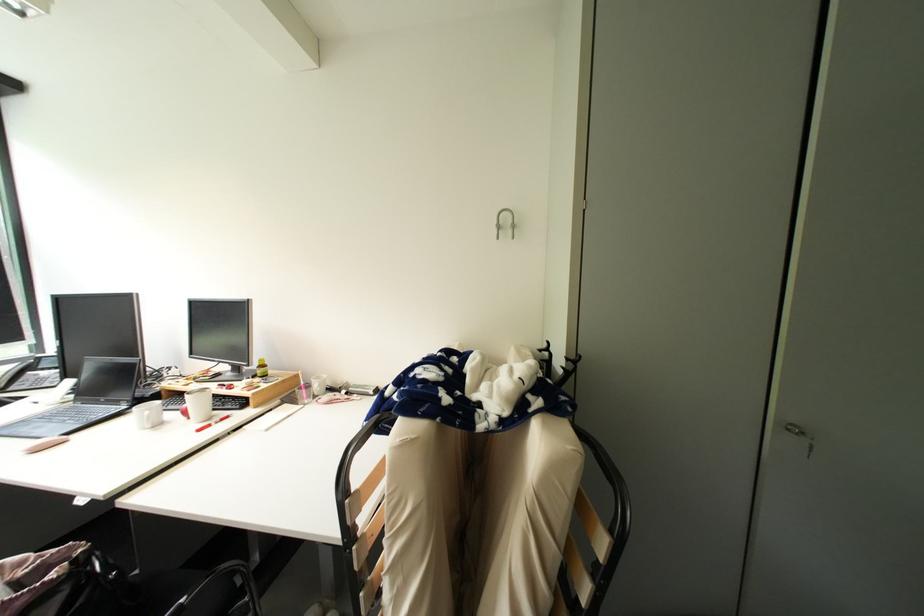
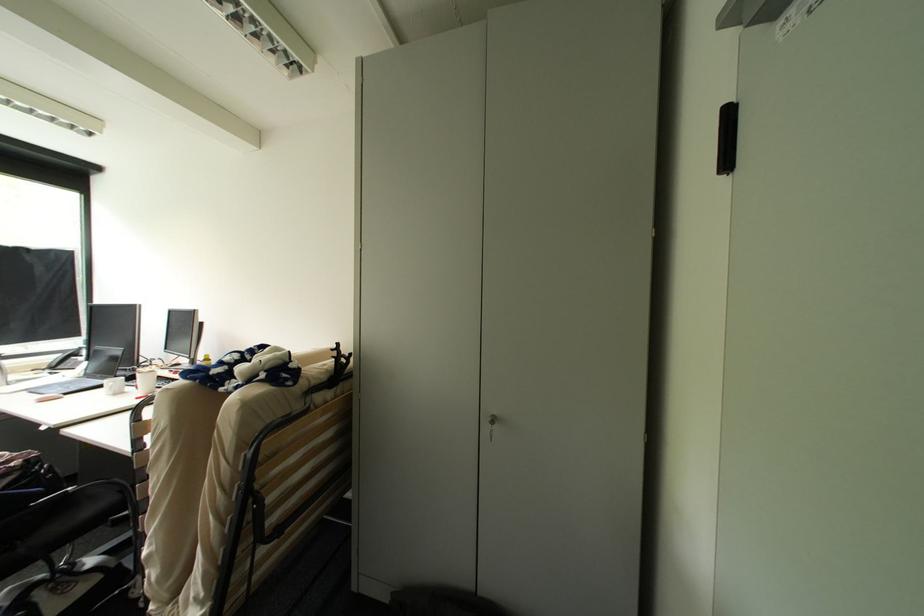
Question: The images are taken continuously from a first-person perspective. In which direction are you moving?

Choices:
 (A) Left
 (B) Right
 (C) Forward
 (D) Backward

Answer: (B)